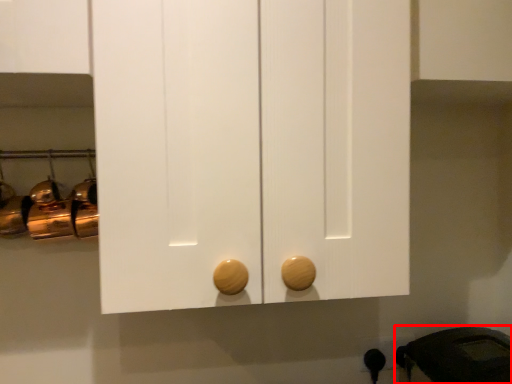
Question: Where is appliance (annotated by the red box) located in relation to door handle in the image?

Choices:
 (A) right
 (B) left

Answer: (A)